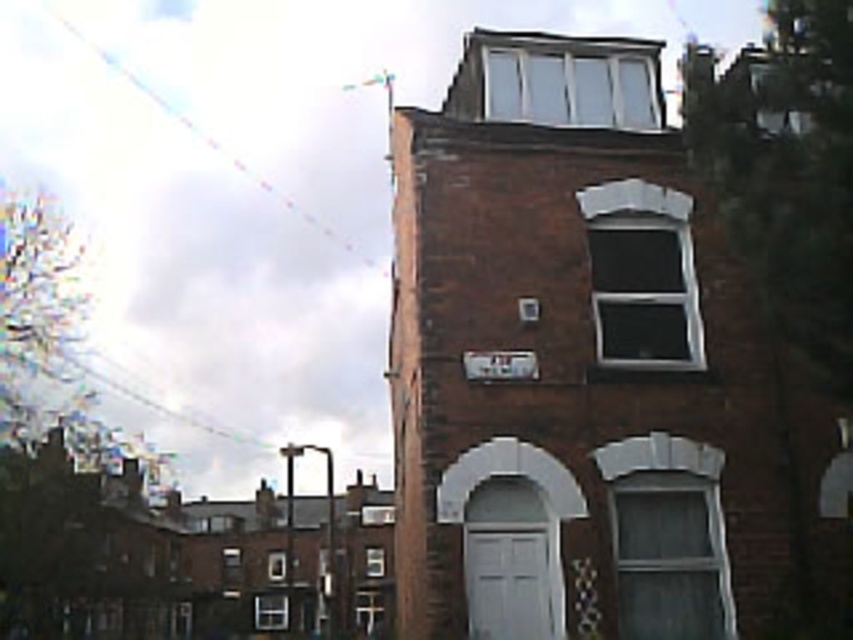
Does point (627, 301) come closer to viewer compared to point (231, 154)?

That is True.

Which is more to the right, brown brick building at center or transparent plastic kite at upper left?

From the viewer's perspective, brown brick building at center appears more on the right side.

Does point (412, 500) come behind point (86, 38)?

No, (412, 500) is closer to viewer.

I want to click on brown brick building at center, so click(x=590, y=372).